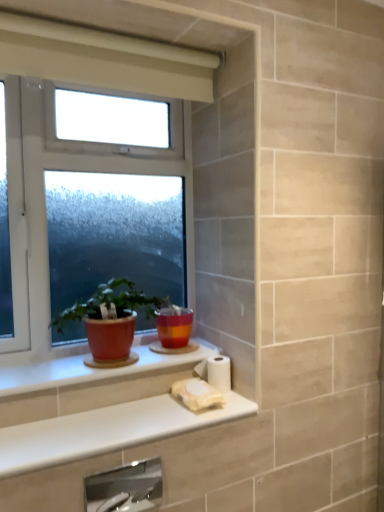
I want to click on free location in front of white matte toilet paper at lower center, the 2th toilet paper in the top-to-bottom sequence, so click(x=182, y=423).